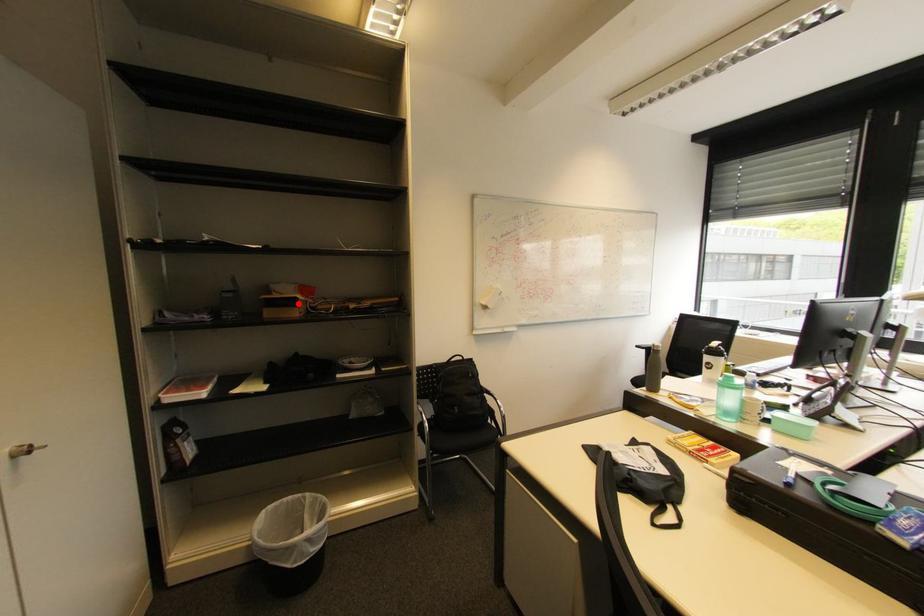
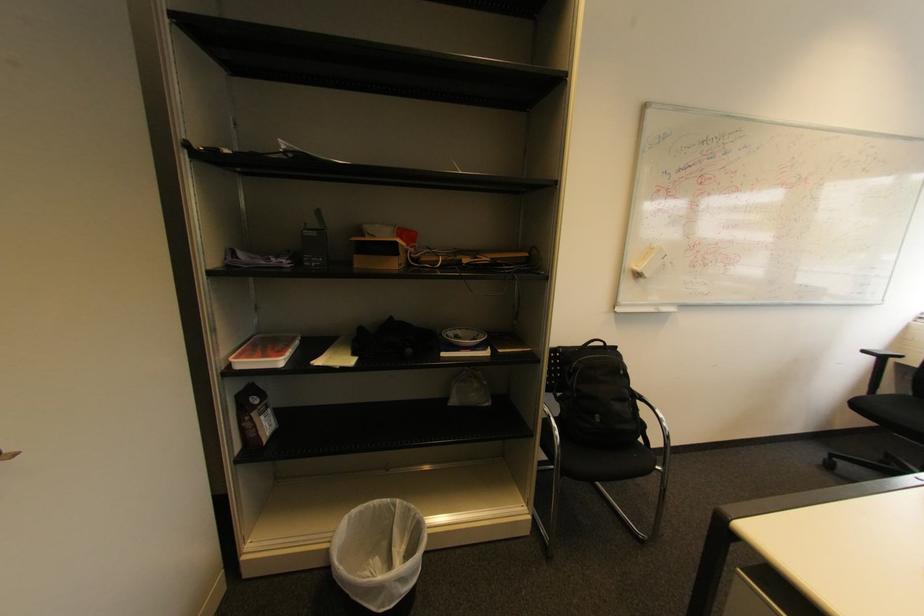
Locate, in the second image, the point that corresponds to the highlighted location in the first image.

(395, 251)